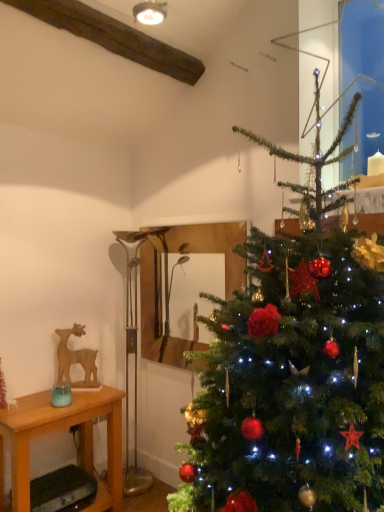
Question: Does wooden table at left have a larger size compared to green matte christmas tree at right?

Choices:
 (A) yes
 (B) no

Answer: (B)

Question: Does wooden table at left appear on the right side of green matte christmas tree at right?

Choices:
 (A) no
 (B) yes

Answer: (A)

Question: Is wooden table at left to the left of green matte christmas tree at right from the viewer's perspective?

Choices:
 (A) no
 (B) yes

Answer: (B)

Question: Is wooden table at left further to camera compared to green matte christmas tree at right?

Choices:
 (A) yes
 (B) no

Answer: (A)

Question: Is green matte christmas tree at right located within wooden table at left?

Choices:
 (A) yes
 (B) no

Answer: (B)

Question: Considering the relative sizes of wooden table at left and green matte christmas tree at right in the image provided, is wooden table at left smaller than green matte christmas tree at right?

Choices:
 (A) no
 (B) yes

Answer: (B)

Question: Is wooden mirror at center to the left of wooden table at left from the viewer's perspective?

Choices:
 (A) no
 (B) yes

Answer: (A)

Question: Is wooden mirror at center smaller than wooden table at left?

Choices:
 (A) no
 (B) yes

Answer: (B)

Question: From a real-world perspective, does wooden mirror at center sit lower than wooden table at left?

Choices:
 (A) yes
 (B) no

Answer: (B)

Question: Does wooden mirror at center turn towards wooden table at left?

Choices:
 (A) no
 (B) yes

Answer: (A)

Question: From a real-world perspective, is wooden mirror at center on top of wooden table at left?

Choices:
 (A) yes
 (B) no

Answer: (A)

Question: Is wooden table at left inside wooden mirror at center?

Choices:
 (A) no
 (B) yes

Answer: (A)

Question: From a real-world perspective, is wooden table at left positioned under wooden deer at left based on gravity?

Choices:
 (A) no
 (B) yes

Answer: (B)